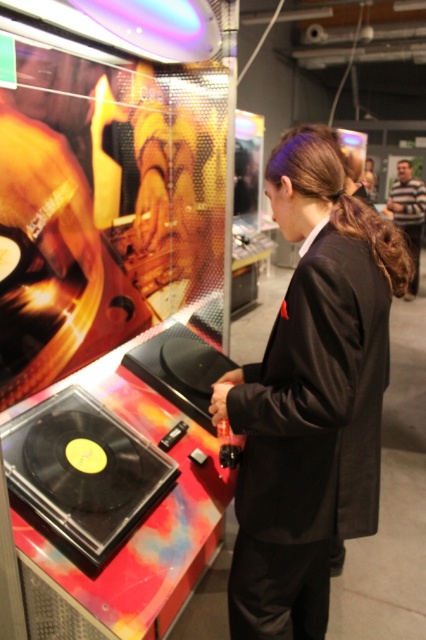
Question: Which of the following is the farthest from the observer?

Choices:
 (A) striped sweater at upper right
 (B) black matte suit at center

Answer: (A)

Question: Can you confirm if black matte suit at center is thinner than striped sweater at upper right?

Choices:
 (A) no
 (B) yes

Answer: (B)

Question: Does black matte suit at center appear on the right side of striped sweater at upper right?

Choices:
 (A) no
 (B) yes

Answer: (A)

Question: Does black matte suit at center have a lesser width compared to striped sweater at upper right?

Choices:
 (A) no
 (B) yes

Answer: (B)

Question: Which object is farther from the camera taking this photo?

Choices:
 (A) striped sweater at upper right
 (B) black matte suit at center

Answer: (A)